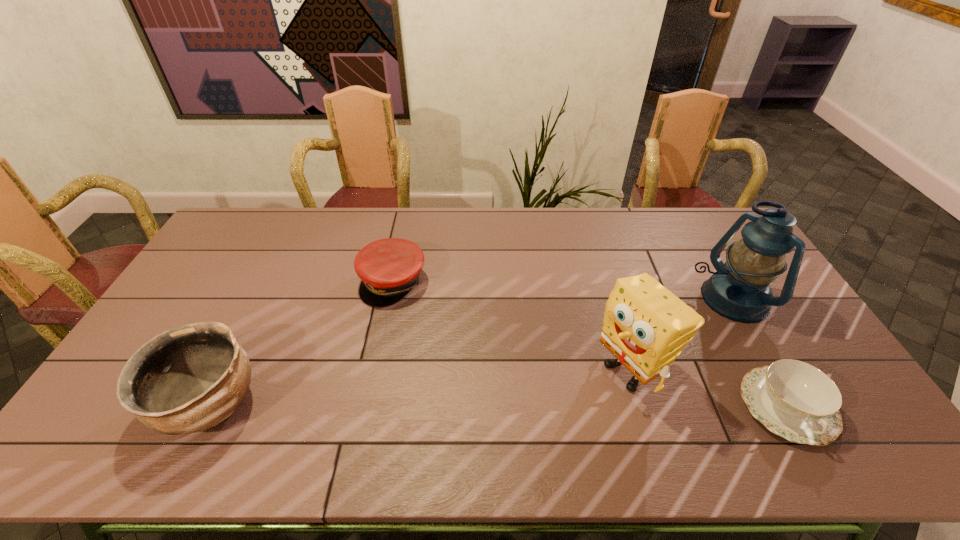
The image size is (960, 540). I want to click on vacant area between the leftmost object and the tallest object, so click(469, 352).

The image size is (960, 540). I want to click on free space between the tallest object and the third shortest object, so click(469, 352).

The image size is (960, 540). In order to click on blank region between the leftmost object and the cap in this screenshot , I will do `click(301, 343)`.

Locate an element on the screen. Image resolution: width=960 pixels, height=540 pixels. free area in between the pottery and the lantern is located at coordinates (469, 352).

Select which object appears as the closest to the second object from left to right. Please provide its 2D coordinates. Your answer should be formatted as a tuple, i.e. [(x, y)], where the tuple contains the x and y coordinates of a point satisfying the conditions above.

[(187, 379)]

Identify the location of the fourth closest object to the cap. The height and width of the screenshot is (540, 960). (795, 400).

You are a GUI agent. You are given a task and a screenshot of the screen. Output one action in this format:
    pyautogui.click(x=<x>, y=<y>)
    Task: Click on the vacant position in the image that satisfies the following two spatial constraints: 1. on the back side of the third object from right to left; 2. on the left side of the third shortest object
    
    Given the screenshot: What is the action you would take?
    pyautogui.click(x=227, y=369)